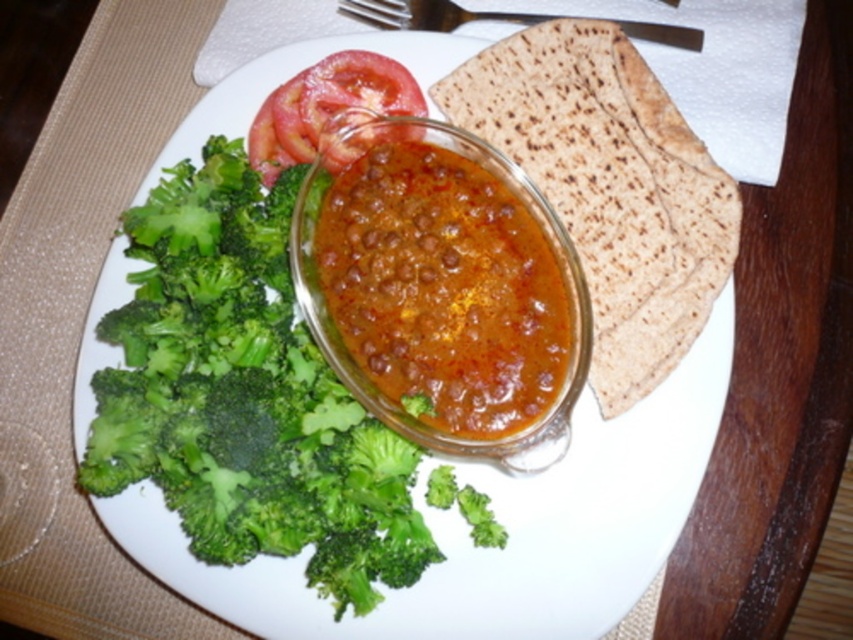
Which is more to the right, brown glossy lentil curry at center or red smooth tomato at upper center?

Positioned to the right is brown glossy lentil curry at center.

Between brown glossy lentil curry at center and red smooth tomato at upper center, which one is positioned higher?

red smooth tomato at upper center is above.

Is point (421, 218) more distant than point (270, 109)?

No, (421, 218) is in front of (270, 109).

What are the coordinates of `brown glossy lentil curry at center` in the screenshot? It's located at (444, 289).

You are a GUI agent. You are given a task and a screenshot of the screen. Output one action in this format:
    pyautogui.click(x=<x>, y=<y>)
    Task: Click on the brown/crumbly tortilla at center-right
    
    Given the screenshot: What is the action you would take?
    pyautogui.click(x=608, y=188)

Does brown/crumbly tortilla at center-right appear on the right side of brushed metal fork at upper center?

Yes, brown/crumbly tortilla at center-right is to the right of brushed metal fork at upper center.

Where is `brown/crumbly tortilla at center-right`? The width and height of the screenshot is (853, 640). brown/crumbly tortilla at center-right is located at coordinates (608, 188).

You are a GUI agent. You are given a task and a screenshot of the screen. Output one action in this format:
    pyautogui.click(x=<x>, y=<y>)
    Task: Click on the brown/crumbly tortilla at center-right
    This screenshot has height=640, width=853.
    Given the screenshot: What is the action you would take?
    pyautogui.click(x=608, y=188)

Can you confirm if brown glossy lentil curry at center is positioned to the right of brushed metal fork at upper center?

Incorrect, brown glossy lentil curry at center is not on the right side of brushed metal fork at upper center.

Locate an element on the screen. The height and width of the screenshot is (640, 853). brown glossy lentil curry at center is located at coordinates (444, 289).

Locate an element on the screen. The width and height of the screenshot is (853, 640). brown glossy lentil curry at center is located at coordinates (444, 289).